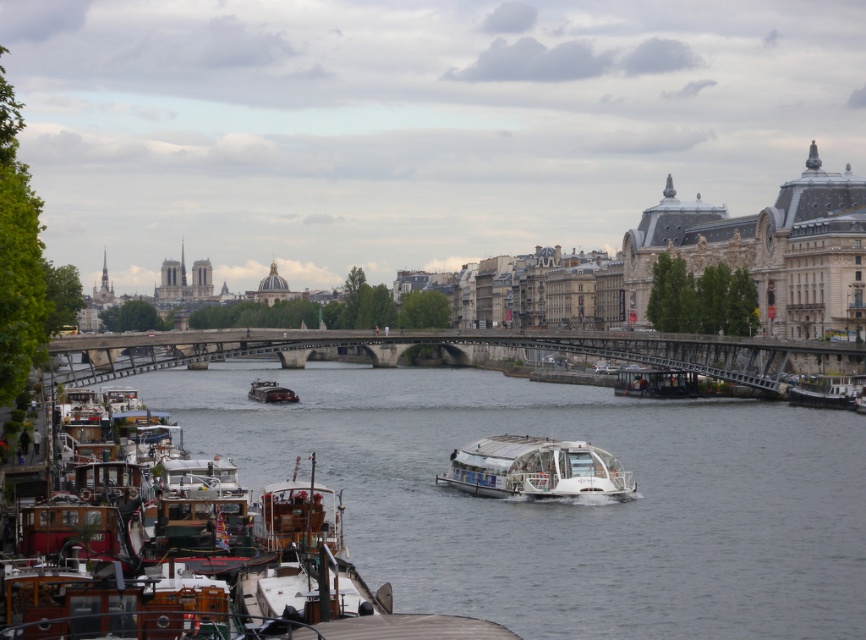
Question: Among these points, which one is nearest to the camera?

Choices:
 (A) (569, 444)
 (B) (832, 397)
 (C) (269, 400)
 (D) (165, 378)

Answer: (A)

Question: Is white glossy boat at lower center above shiny dark brown boat at center?

Choices:
 (A) yes
 (B) no

Answer: (B)

Question: Does white glossy boat at center come behind wooden boat at right?

Choices:
 (A) yes
 (B) no

Answer: (B)

Question: Which point is farther to the camera?

Choices:
 (A) (538, 339)
 (B) (797, 401)
 (C) (260, 385)

Answer: (C)

Question: Is white glossy boat at lower center positioned behind shiny dark brown boat at center?

Choices:
 (A) no
 (B) yes

Answer: (A)

Question: Which object is closer to the camera taking this photo?

Choices:
 (A) white glossy boat at center
 (B) concrete bridge at center
 (C) shiny dark brown boat at center
 (D) wooden boat at right

Answer: (A)